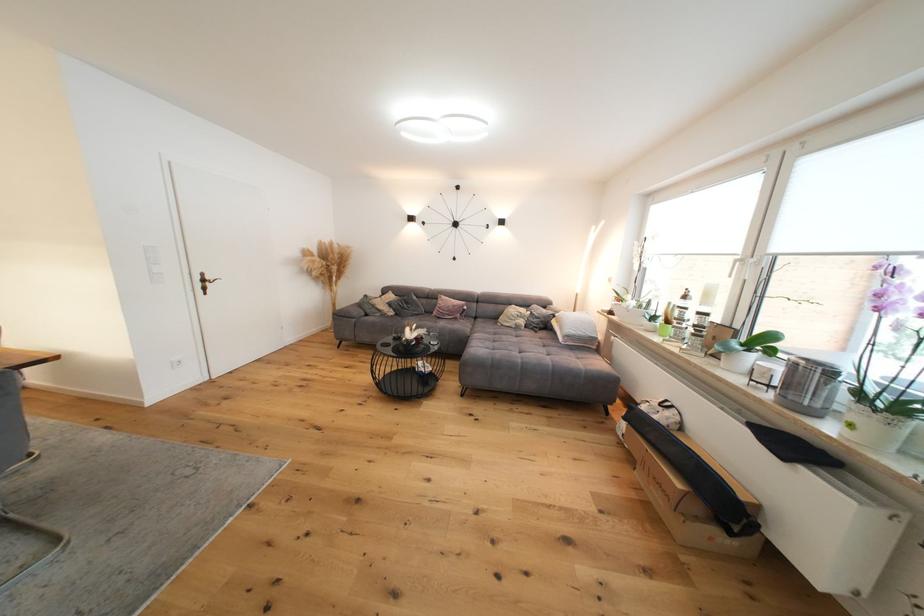
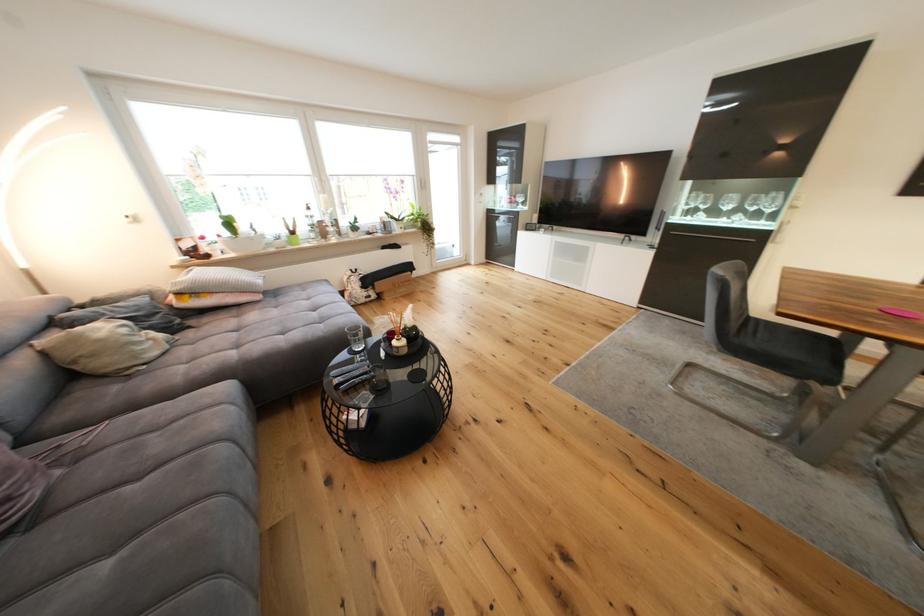
In the second image, find the point that corresponds to (x=456, y=313) in the first image.

(18, 469)